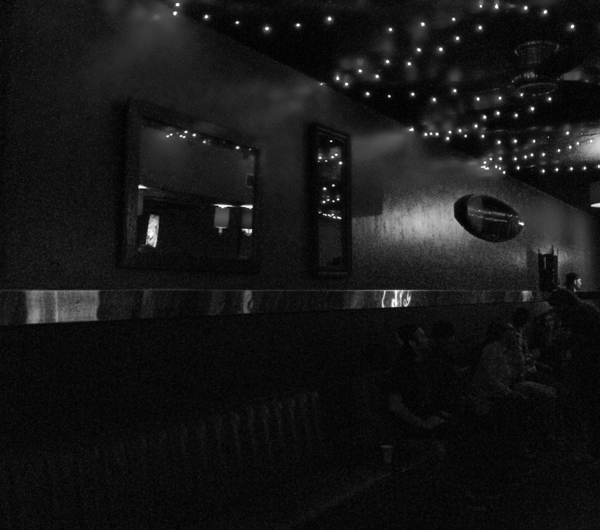
In order to click on light fixture or ceiling fan in this screenshot , I will do `click(536, 79)`.